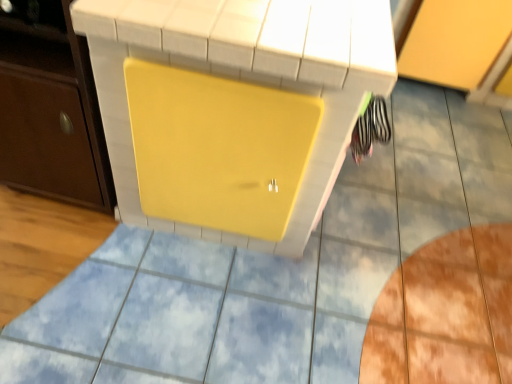
Question: Is matte brown cabinet at left, the first cabinetry when ordered from left to right, in contact with yellow matte cabinet at upper right, placed as the first cabinetry when sorted from right to left?

Choices:
 (A) yes
 (B) no

Answer: (B)

Question: Does matte brown cabinet at left, placed as the 2th cabinetry when sorted from back to front, have a greater width compared to yellow matte cabinet at upper right, which is the 2th cabinetry in front-to-back order?

Choices:
 (A) no
 (B) yes

Answer: (A)

Question: Is matte brown cabinet at left, marked as the second cabinetry in a right-to-left arrangement, further to the viewer compared to yellow matte cabinet at upper right, which is the 2th cabinetry in front-to-back order?

Choices:
 (A) no
 (B) yes

Answer: (A)

Question: Is yellow matte cabinet at upper right, placed as the first cabinetry when sorted from right to left, completely or partially inside matte brown cabinet at left, marked as the second cabinetry in a right-to-left arrangement?

Choices:
 (A) yes
 (B) no

Answer: (B)

Question: Is matte brown cabinet at left, the first cabinetry when ordered from left to right, closer to the viewer compared to yellow matte cabinet at upper right, which is the 2th cabinetry in front-to-back order?

Choices:
 (A) yes
 (B) no

Answer: (A)

Question: Considering the positions of point (198, 230) and point (19, 175), is point (198, 230) closer or farther from the camera than point (19, 175)?

Choices:
 (A) closer
 (B) farther

Answer: (A)

Question: Is yellow matte vanity at center inside the boundaries of matte brown cabinet at left, placed as the 2th cabinetry when sorted from back to front, or outside?

Choices:
 (A) outside
 (B) inside

Answer: (A)

Question: Is yellow matte vanity at center to the left or to the right of matte brown cabinet at left, placed as the 2th cabinetry when sorted from back to front, in the image?

Choices:
 (A) right
 (B) left

Answer: (A)

Question: In the image, is yellow matte vanity at center positioned in front of or behind matte brown cabinet at left, the 1th cabinetry positioned from the front?

Choices:
 (A) behind
 (B) front

Answer: (B)

Question: Looking at their shapes, would you say matte brown cabinet at left, marked as the second cabinetry in a right-to-left arrangement, is wider or thinner than yellow matte cabinet at upper right, the second cabinetry from the left?

Choices:
 (A) thin
 (B) wide

Answer: (A)

Question: Would you say matte brown cabinet at left, the first cabinetry when ordered from left to right, is to the left or to the right of yellow matte cabinet at upper right, placed as the first cabinetry when sorted from right to left, in the picture?

Choices:
 (A) left
 (B) right

Answer: (A)

Question: Relative to yellow matte cabinet at upper right, which ranks as the first cabinetry in back-to-front order, is matte brown cabinet at left, the 1th cabinetry positioned from the front, in front or behind?

Choices:
 (A) front
 (B) behind

Answer: (A)

Question: Looking at the image, does matte brown cabinet at left, marked as the second cabinetry in a right-to-left arrangement, seem bigger or smaller compared to yellow matte cabinet at upper right, which is the 2th cabinetry in front-to-back order?

Choices:
 (A) big
 (B) small

Answer: (B)

Question: Is yellow matte cabinet at upper right, which ranks as the first cabinetry in back-to-front order, inside the boundaries of yellow matte vanity at center, or outside?

Choices:
 (A) inside
 (B) outside

Answer: (B)

Question: From a real-world perspective, is yellow matte cabinet at upper right, which ranks as the first cabinetry in back-to-front order, positioned above or below yellow matte vanity at center?

Choices:
 (A) below
 (B) above

Answer: (A)